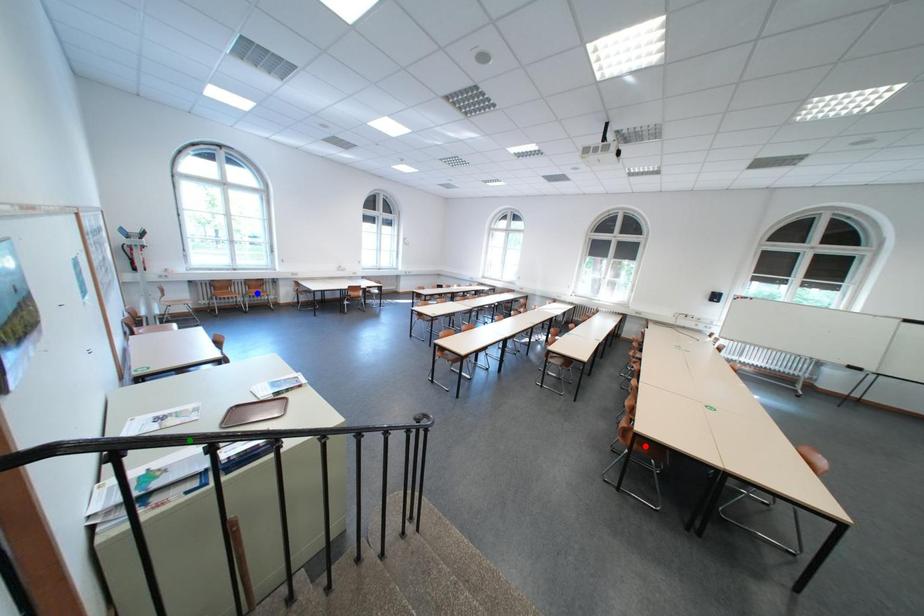
Order these from nearest to farthest:
1. blue point
2. green point
3. red point

green point → red point → blue point